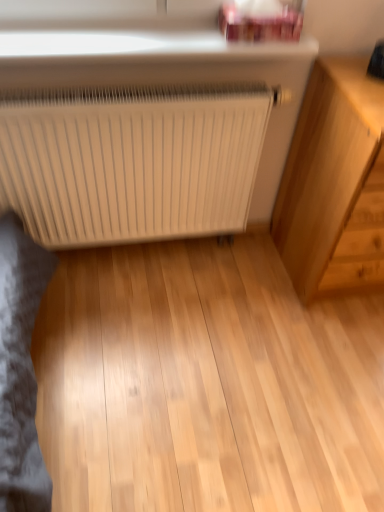
This screenshot has height=512, width=384. I want to click on free spot to the right of white matte radiator at center, so click(253, 301).